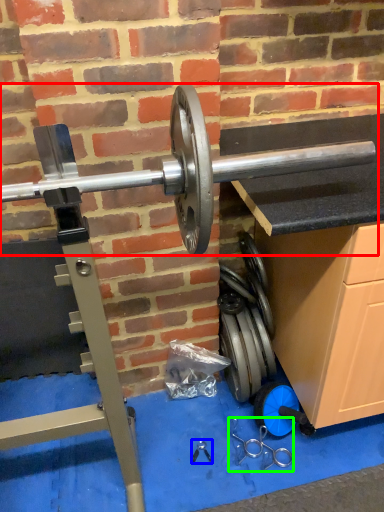
Question: Which object is positioned closest to barbell (highlighted by a red box)? Select from tool (highlighted by a blue box) and tool (highlighted by a green box).

Choices:
 (A) tool
 (B) tool

Answer: (B)